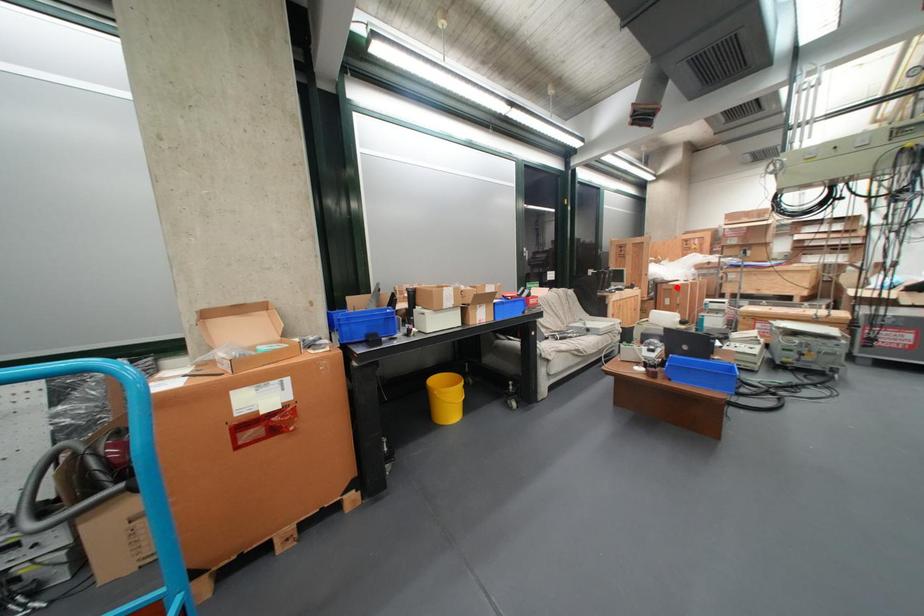
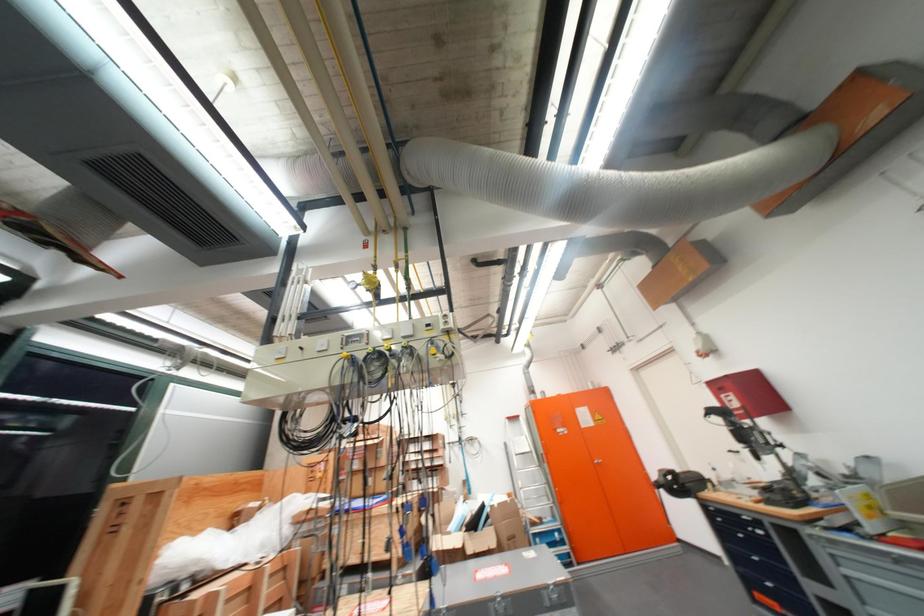
Question: I am providing you with two images of the same scene from different viewpoints. Image1 has a red point marked. In image2, the corresponding 3D location appears at what relative position? Reply with the corresponding letter.

Choices:
 (A) Closer
 (B) Farther

Answer: (A)